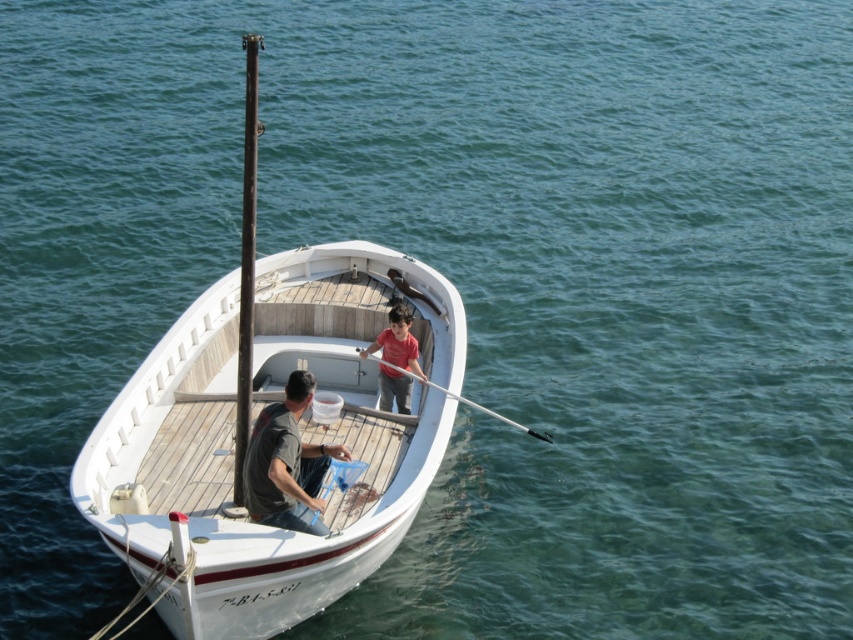
Which is behind, point (259, 499) or point (399, 310)?

The point (399, 310) is behind.

The height and width of the screenshot is (640, 853). I want to click on dark gray fabric shirt at center, so click(287, 464).

This screenshot has width=853, height=640. I want to click on dark gray fabric shirt at center, so click(x=287, y=464).

Can you confirm if dark gray fabric shirt at center is positioned above dark brown wooden pole at center?

No.

What do you see at coordinates (287, 464) in the screenshot?
I see `dark gray fabric shirt at center` at bounding box center [287, 464].

Is point (245, 476) positioned in front of point (233, 452)?

Yes, it is.

At what (x,y) coordinates should I click in order to perform the action: click on dark gray fabric shirt at center. Please return your answer as a coordinate pair (x, y). The width and height of the screenshot is (853, 640). Looking at the image, I should click on (287, 464).

Who is lower down, dark brown wooden pole at center or smooth white pole at center?

Positioned lower is smooth white pole at center.

Which of these two, dark brown wooden pole at center or smooth white pole at center, stands shorter?

With less height is smooth white pole at center.

Which is in front, point (239, 323) or point (503, 419)?

Point (503, 419)

Find the location of a particular element. The width and height of the screenshot is (853, 640). dark brown wooden pole at center is located at coordinates (247, 262).